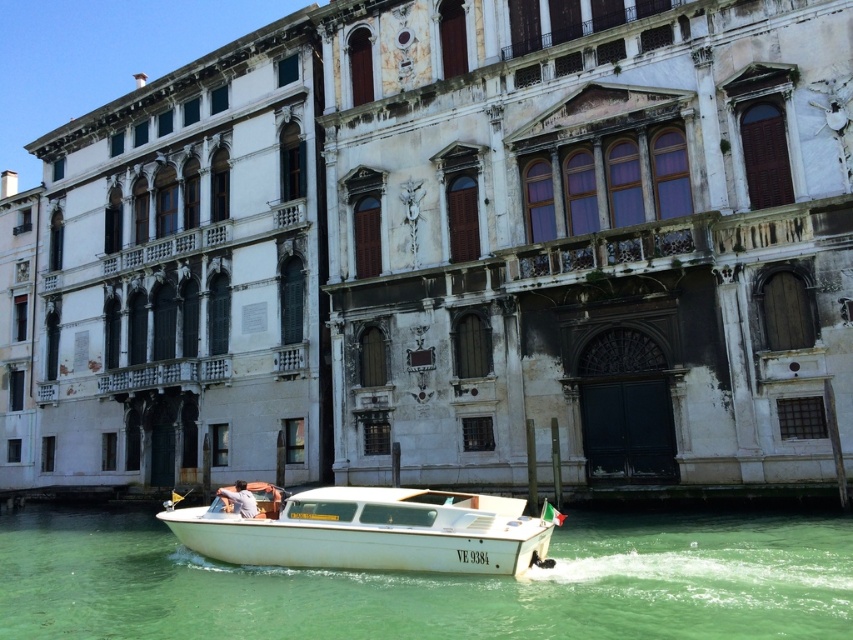
Between green water at boat front and light blue shirt at center, which one is positioned lower?

green water at boat front is below.

Is green water at boat front further to the viewer compared to light blue shirt at center?

No, it is in front of light blue shirt at center.

Locate an element on the screen. green water at boat front is located at coordinates (434, 582).

Which is below, green water at boat front or white glossy boat at center?

Positioned lower is green water at boat front.

Does green water at boat front have a lesser width compared to white glossy boat at center?

No.

You are a GUI agent. You are given a task and a screenshot of the screen. Output one action in this format:
    pyautogui.click(x=<x>, y=<y>)
    Task: Click on the green water at boat front
    
    Given the screenshot: What is the action you would take?
    pyautogui.click(x=434, y=582)

At what (x,y) coordinates should I click in order to perform the action: click on green water at boat front. Please return your answer as a coordinate pair (x, y). The height and width of the screenshot is (640, 853). Looking at the image, I should click on (434, 582).

Is point (560, 516) less distant than point (236, 483)?

That is True.

Does white glossy boat at center have a greater width compared to light blue shirt at center?

Indeed, white glossy boat at center has a greater width compared to light blue shirt at center.

Does point (448, 529) lie behind point (253, 500)?

No.

The height and width of the screenshot is (640, 853). Find the location of `white glossy boat at center`. white glossy boat at center is located at coordinates (370, 531).